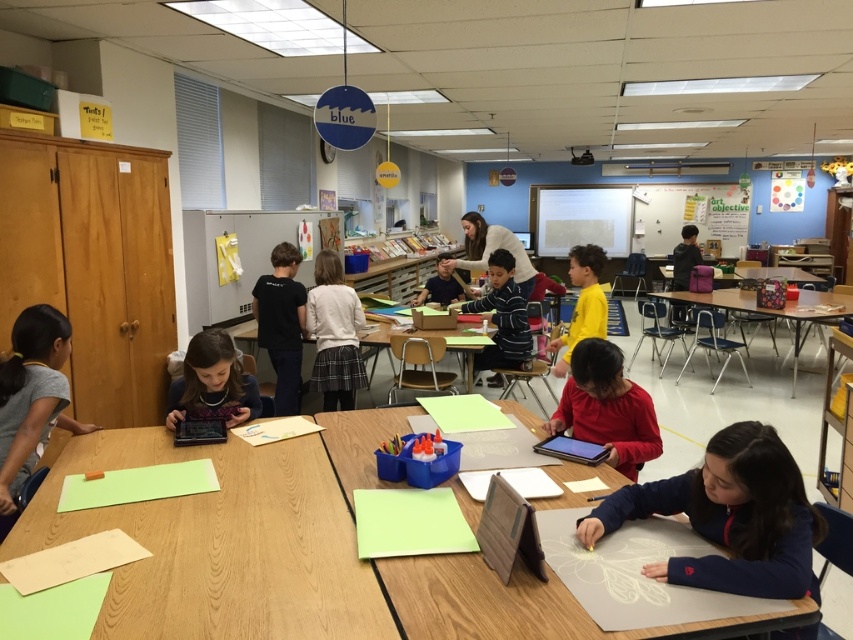
Who is shorter, matte red shirt at center or matte black shirt at center?

With less height is matte black shirt at center.

Between matte red shirt at center and matte black shirt at center, which one is positioned lower?

matte red shirt at center is lower down.

At what (x,y) coordinates should I click in order to perform the action: click on matte red shirt at center. Please return your answer as a coordinate pair (x, y). This screenshot has height=640, width=853. Looking at the image, I should click on (607, 406).

Is wooden table at center bigger than matte black shirt at center?

Indeed, wooden table at center has a larger size compared to matte black shirt at center.

Is wooden table at center to the right of matte black shirt at center from the viewer's perspective?

Incorrect, wooden table at center is not on the right side of matte black shirt at center.

Does point (238, 557) come in front of point (416, 296)?

Yes, point (238, 557) is in front of point (416, 296).

Locate an element on the screen. wooden table at center is located at coordinates (219, 545).

Can you confirm if smooth wooden table at lower center is taller than matte red shirt at center?

No.

Does smooth wooden table at lower center appear on the left side of matte red shirt at center?

Correct, you'll find smooth wooden table at lower center to the left of matte red shirt at center.

Describe the element at coordinates (521, 605) in the screenshot. I see `smooth wooden table at lower center` at that location.

You are a GUI agent. You are given a task and a screenshot of the screen. Output one action in this format:
    pyautogui.click(x=<x>, y=<y>)
    Task: Click on the smooth wooden table at lower center
    Image resolution: width=853 pixels, height=640 pixels.
    Given the screenshot: What is the action you would take?
    pyautogui.click(x=521, y=605)